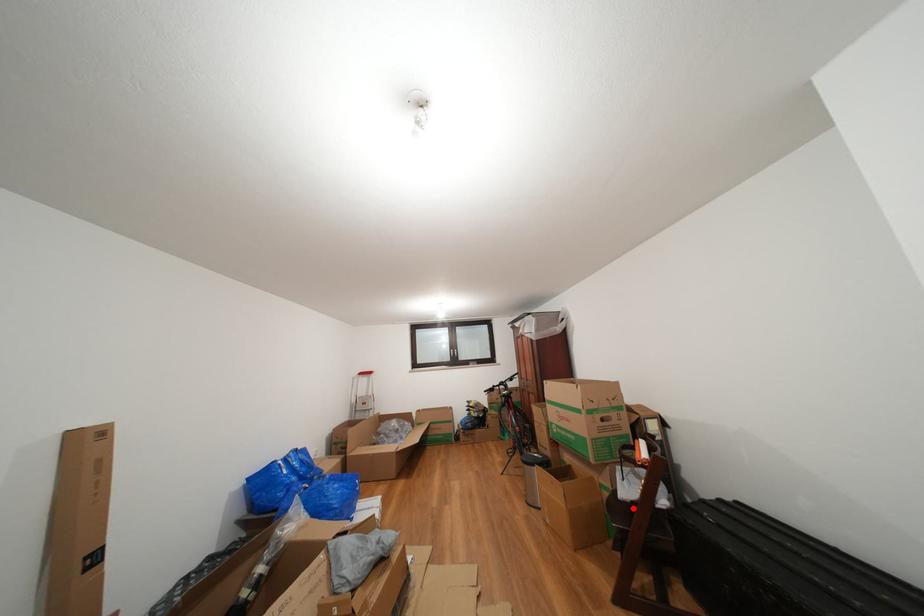
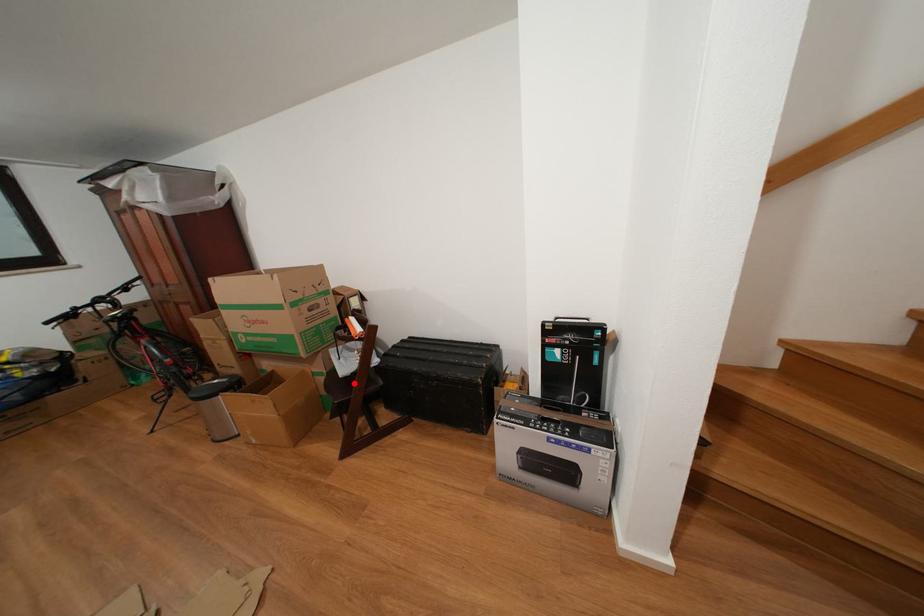
Consider the image. I am providing you with two images of the same scene from different viewpoints. A red point is marked on the first image and another point is marked on the second image. Is the red point in image1 aligned with the point shown in image2?

Yes